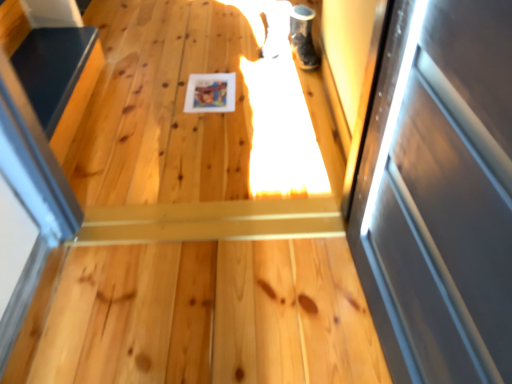
Question: Is shiny black shoe at upper right inside or outside of smooth black surface at left?

Choices:
 (A) inside
 (B) outside

Answer: (B)

Question: In the image, is shiny black shoe at upper right positioned in front of or behind smooth black surface at left?

Choices:
 (A) front
 (B) behind

Answer: (B)

Question: From the image's perspective, is shiny black shoe at upper right positioned above or below smooth black surface at left?

Choices:
 (A) below
 (B) above

Answer: (B)

Question: In terms of height, does smooth black surface at left look taller or shorter compared to shiny black shoe at upper right?

Choices:
 (A) short
 (B) tall

Answer: (A)

Question: Visually, is smooth black surface at left positioned to the left or to the right of shiny black shoe at upper right?

Choices:
 (A) left
 (B) right

Answer: (A)

Question: From a real-world perspective, is smooth black surface at left positioned above or below shiny black shoe at upper right?

Choices:
 (A) above
 (B) below

Answer: (B)

Question: Is point (12, 39) positioned closer to the camera than point (290, 43)?

Choices:
 (A) closer
 (B) farther

Answer: (A)